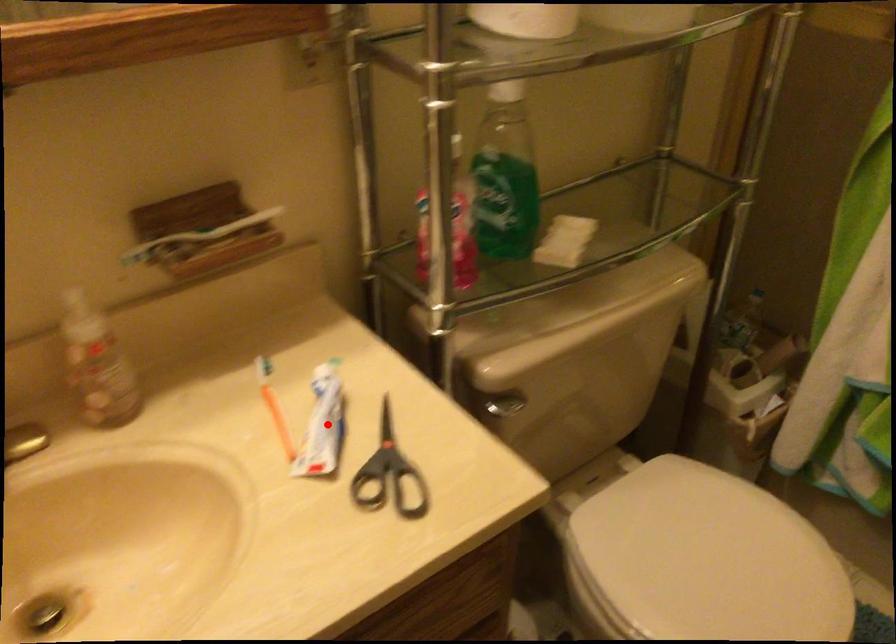
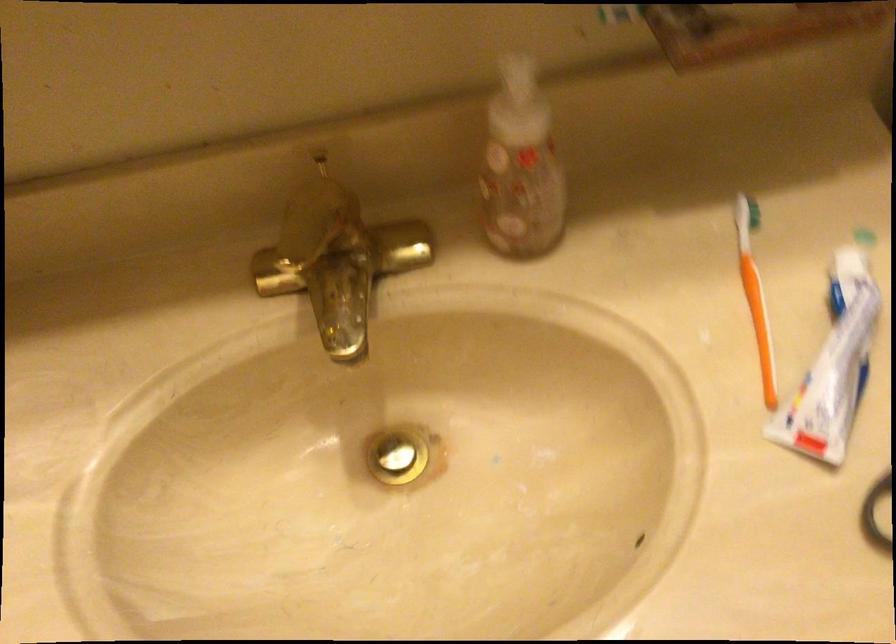
The point at the highlighted location is marked in the first image. Where is the corresponding point in the second image?

(833, 366)